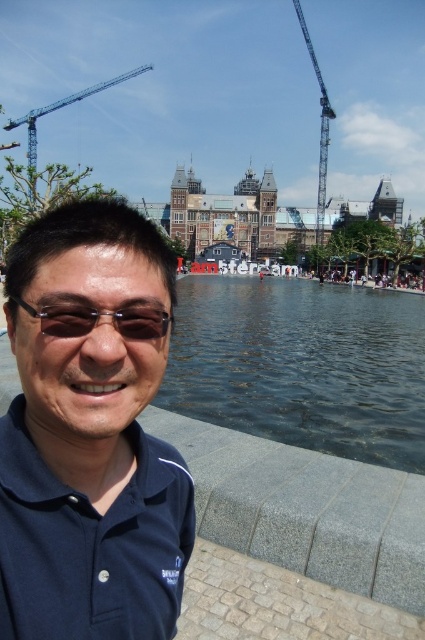
You are a photographer trying to capture a photo of the sunglasses at center and the metallic blue crane at upper right. Which object will appear smaller in your photo?

The sunglasses at center will appear smaller in the photo because they have a smaller size compared to the metallic blue crane at upper right.

You are standing at point [70,102] and want to walk to the historic building in the background. Which direction should you move relative to point [129,323]?

You should move away from point [129,323] because point [129,323] is in front of point [70,102], meaning the historic building is behind point [70,102].